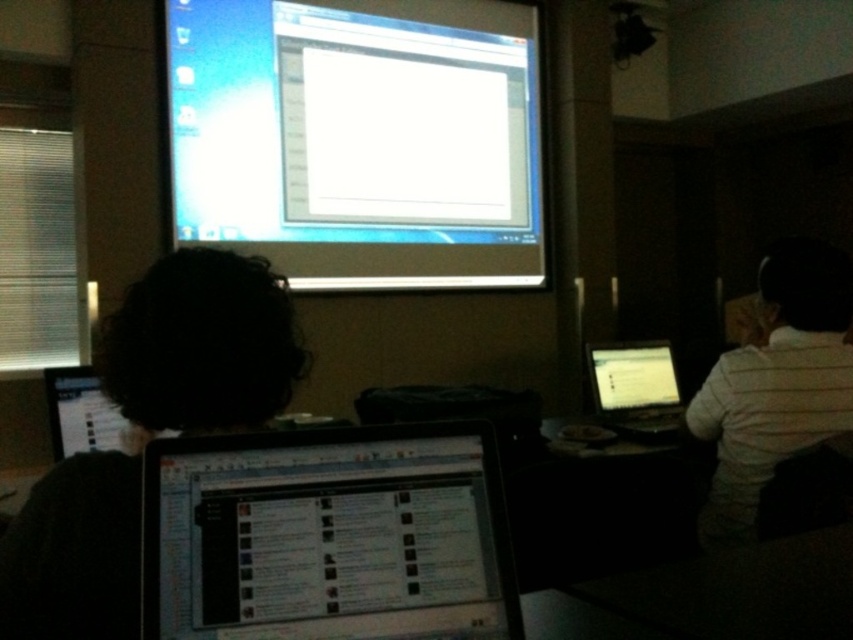
Which of these two, black matte hair at center or black glossy laptop at right, stands shorter?

Standing shorter between the two is black glossy laptop at right.

Does point (274, 310) come in front of point (610, 372)?

That is True.

In order to click on black matte hair at center in this screenshot , I will do `click(202, 344)`.

Does white glossy projector screen at upper center have a smaller size compared to matte black laptop at center?

Incorrect, white glossy projector screen at upper center is not smaller in size than matte black laptop at center.

Can you confirm if white glossy projector screen at upper center is thinner than matte black laptop at center?

In fact, white glossy projector screen at upper center might be wider than matte black laptop at center.

Is point (276, 140) in front of point (434, 449)?

No.

Locate an element on the screen. white glossy projector screen at upper center is located at coordinates (358, 138).

Is point (534, 268) positioned behind point (44, 605)?

That is True.

Between white glossy projector screen at upper center and black matte hair at center, which one appears on the left side from the viewer's perspective?

black matte hair at center is more to the left.

Between point (434, 116) and point (222, 403), which one is positioned behind?

The point (434, 116) is more distant.

Locate an element on the screen. white glossy projector screen at upper center is located at coordinates (358, 138).